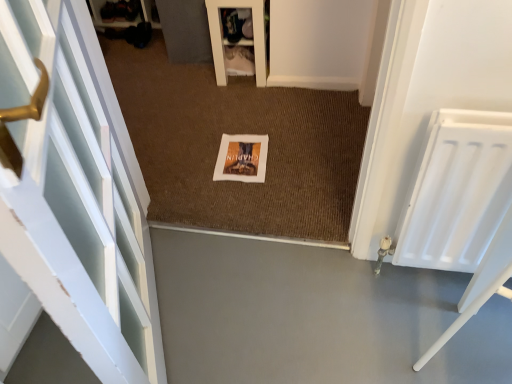
Question: Is white fabric shoe rack at upper center bigger than gray smooth concrete at center?

Choices:
 (A) yes
 (B) no

Answer: (B)

Question: From the image's perspective, is white fabric shoe rack at upper center under gray smooth concrete at center?

Choices:
 (A) yes
 (B) no

Answer: (B)

Question: Is white fabric shoe rack at upper center to the right of gray smooth concrete at center from the viewer's perspective?

Choices:
 (A) no
 (B) yes

Answer: (B)

Question: Considering the relative sizes of white fabric shoe rack at upper center and gray smooth concrete at center in the image provided, is white fabric shoe rack at upper center smaller than gray smooth concrete at center?

Choices:
 (A) yes
 (B) no

Answer: (A)

Question: Considering the relative positions of white fabric shoe rack at upper center and gray smooth concrete at center in the image provided, is white fabric shoe rack at upper center to the left of gray smooth concrete at center from the viewer's perspective?

Choices:
 (A) no
 (B) yes

Answer: (A)

Question: Considering the positions of white painted wood door at left and white fabric shoe rack at upper center in the image, is white painted wood door at left wider or thinner than white fabric shoe rack at upper center?

Choices:
 (A) thin
 (B) wide

Answer: (A)

Question: From the image's perspective, is white painted wood door at left positioned above or below white fabric shoe rack at upper center?

Choices:
 (A) below
 (B) above

Answer: (A)

Question: Considering the positions of white painted wood door at left and white fabric shoe rack at upper center in the image, is white painted wood door at left bigger or smaller than white fabric shoe rack at upper center?

Choices:
 (A) small
 (B) big

Answer: (B)

Question: Relative to white fabric shoe rack at upper center, is white painted wood door at left in front or behind?

Choices:
 (A) behind
 (B) front

Answer: (B)

Question: From a real-world perspective, relative to white matte picture frame at center, is brown textured mat at center vertically above or below?

Choices:
 (A) above
 (B) below

Answer: (B)

Question: From the image's perspective, is brown textured mat at center above or below white matte picture frame at center?

Choices:
 (A) below
 (B) above

Answer: (B)

Question: Would you say brown textured mat at center is inside or outside white matte picture frame at center?

Choices:
 (A) outside
 (B) inside

Answer: (A)

Question: Considering their positions, is brown textured mat at center located in front of or behind white matte picture frame at center?

Choices:
 (A) behind
 (B) front

Answer: (B)

Question: From the image's perspective, is brown textured mat at center positioned above or below white fabric shoe rack at upper center?

Choices:
 (A) below
 (B) above

Answer: (A)

Question: In terms of size, does brown textured mat at center appear bigger or smaller than white fabric shoe rack at upper center?

Choices:
 (A) big
 (B) small

Answer: (A)